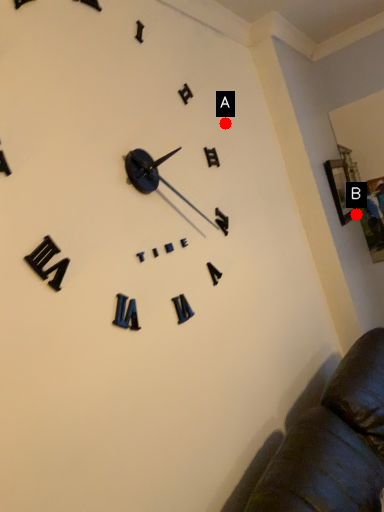
Question: Two points are circled on the image, labeled by A and B beside each circle. Which of the following is the closest to the observer?

Choices:
 (A) A is closer
 (B) B is closer

Answer: (A)